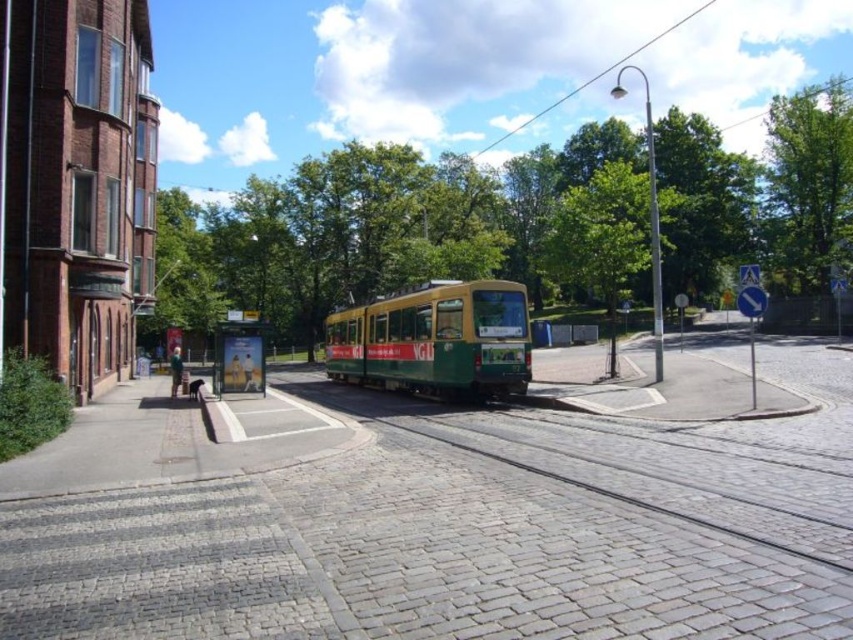
Does green metal train track at center lie in front of green matte tram at center?

Yes, it is in front of green matte tram at center.

Is green metal train track at center taller than green matte tram at center?

In fact, green metal train track at center may be shorter than green matte tram at center.

This screenshot has height=640, width=853. I want to click on green metal train track at center, so click(616, 468).